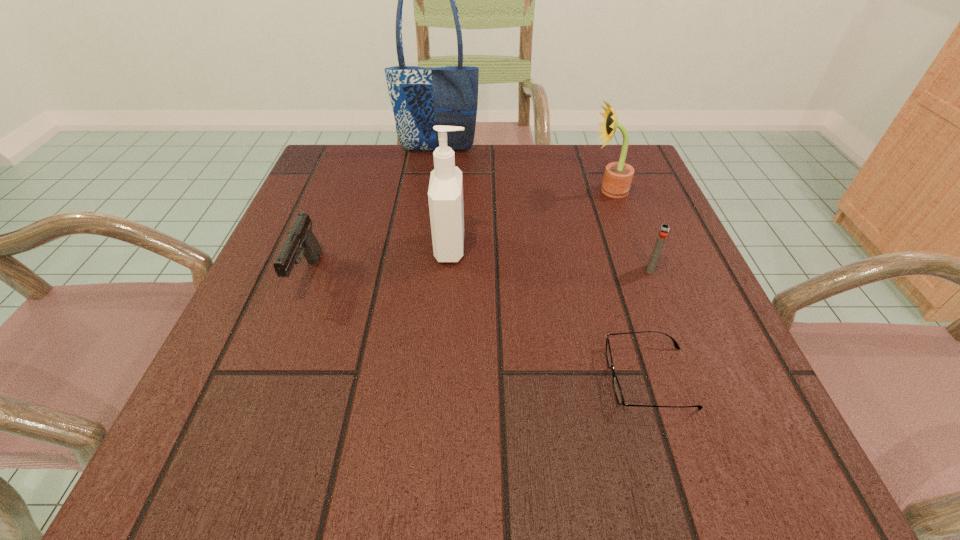
Identify the location of vacant area at the left edge of the desktop. (351, 265).

In the image, there is a desktop. Where is `vacant space at the right edge`? Image resolution: width=960 pixels, height=540 pixels. vacant space at the right edge is located at coordinates (588, 202).

I want to click on free location at the far left corner of the desktop, so click(357, 152).

Where is `free space at the far right corner`? free space at the far right corner is located at coordinates (633, 185).

Locate an element on the screen. This screenshot has width=960, height=540. empty location between the nearest object and the igniter is located at coordinates (x=650, y=323).

Locate an element on the screen. The width and height of the screenshot is (960, 540). empty space that is in between the leftmost object and the second tallest object is located at coordinates (379, 262).

I want to click on free point between the igniter and the fifth nearest object, so click(630, 230).

Identify the location of unoccupied position between the farthest object and the spectacles. This screenshot has width=960, height=540. (543, 264).

Identify the location of free space between the igniter and the second farthest object. The height and width of the screenshot is (540, 960). (630, 230).

Locate an element on the screen. Image resolution: width=960 pixels, height=540 pixels. free space that is in between the farthest object and the fifth nearest object is located at coordinates tap(523, 171).